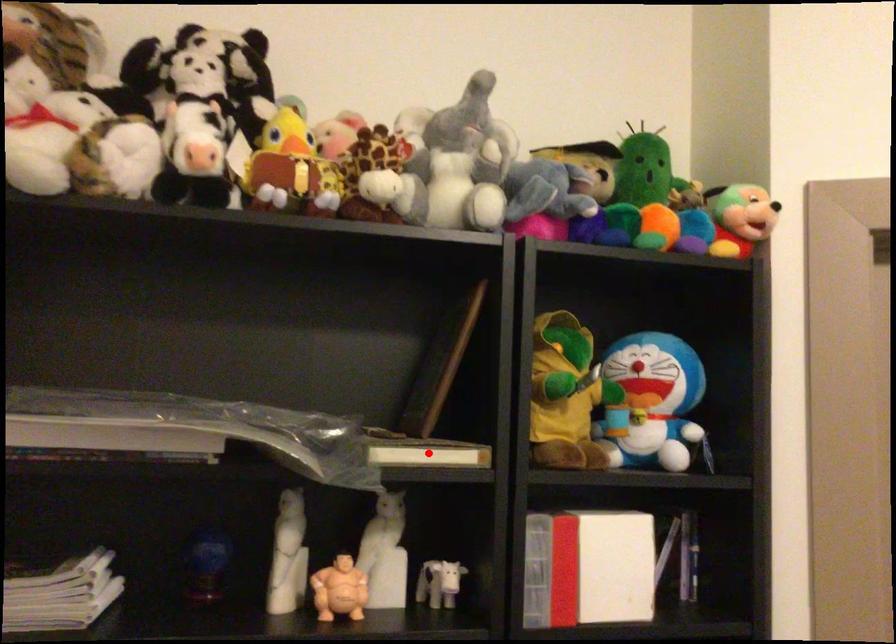
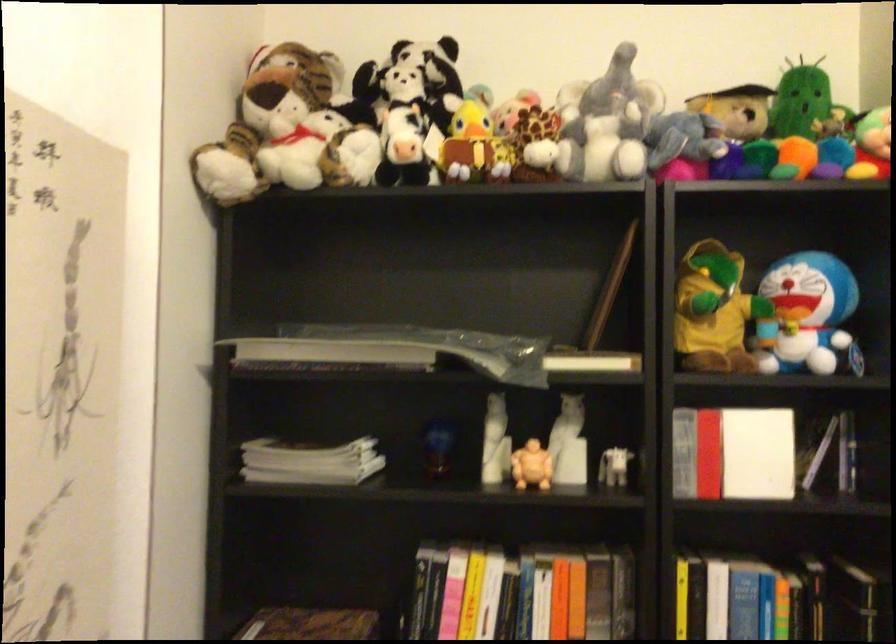
Question: I am providing you with two images of the same scene from different viewpoints. Image1 has a red point marked. In image2, the corresponding 3D location appears at what relative position? Reply with the corresponding letter.

Choices:
 (A) Closer
 (B) Farther

Answer: (B)